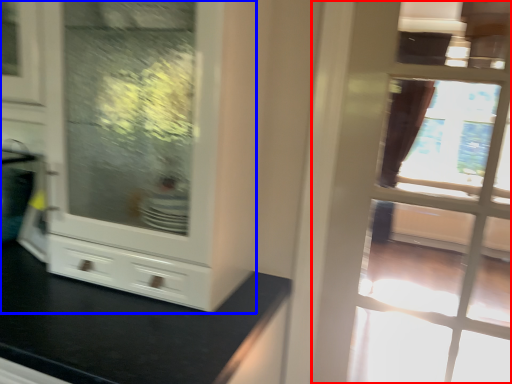
Question: Among these objects, which one is farthest to the camera, door (highlighted by a red box) or cabinetry (highlighted by a blue box)?

Choices:
 (A) door
 (B) cabinetry

Answer: (A)